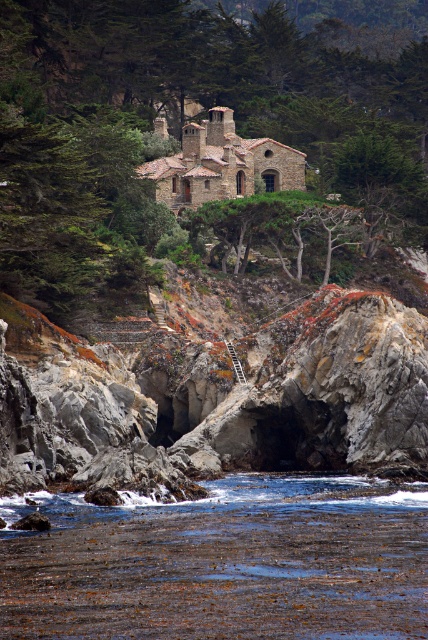
You are a hiker who wants to take a photo of the brown seaweed at lower center and the green leafy tree at upper center. Which object should you focus on first if you want to capture both in a single frame without moving the camera?

The green leafy tree at upper center is positioned on the right side of brown seaweed at lower center. To capture both in a single frame without moving the camera, you should focus on the brown seaweed at lower center first since it is closer to the camera, allowing the tree to be in the background.

You are a hiker who wants to take a photo of the brown seaweed at lower center and the green leafy tree at upper center. Which object should you focus on first if you want to capture both in a single frame without moving the camera?

You should focus on the green leafy tree at upper center first because it is wider than the brown seaweed at lower center, allowing it to fit better in the frame.